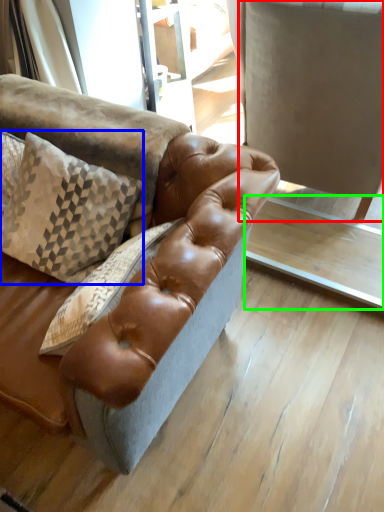
Question: Estimate the real-world distances between objects in this image. Which object is farther from swivel chair (highlighted by a red box), pillow (highlighted by a blue box) or table (highlighted by a green box)?

Choices:
 (A) pillow
 (B) table

Answer: (A)